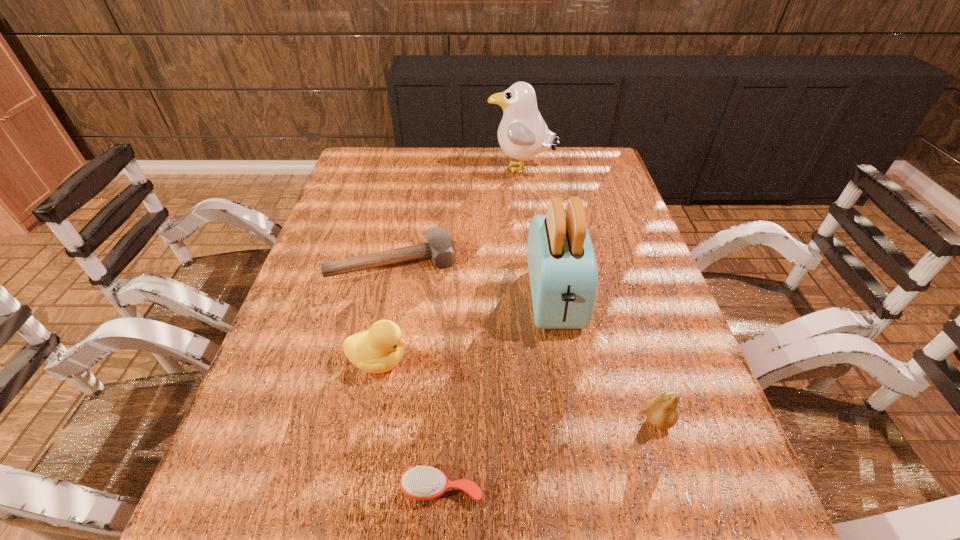
You are a GUI agent. You are given a task and a screenshot of the screen. Output one action in this format:
    pyautogui.click(x=<x>, y=<y>)
    Task: Click on the free space between the farthest object and the nearest object
    The height and width of the screenshot is (540, 960).
    Given the screenshot: What is the action you would take?
    pyautogui.click(x=481, y=329)

Locate an element on the screen. free spot between the toaster and the shortest object is located at coordinates (498, 393).

Choose which object is the fourth nearest neighbor to the second shortest object. Please provide its 2D coordinates. Your answer should be formatted as a tuple, i.e. [(x, y)], where the tuple contains the x and y coordinates of a point satisfying the conditions above.

[(419, 482)]

Where is `object that is the third closest to the shortest object`? object that is the third closest to the shortest object is located at coordinates (662, 411).

Find the location of a particular element. vacant space that satisfies the following two spatial constraints: 1. on the side of the toaster with the lever; 2. on the front-facing side of the duck is located at coordinates (565, 361).

Image resolution: width=960 pixels, height=540 pixels. I want to click on free region that satisfies the following two spatial constraints: 1. on the back side of the second nearest object; 2. on the front-facing side of the fourth farthest object, so click(x=640, y=361).

This screenshot has height=540, width=960. I want to click on free point that satisfies the following two spatial constraints: 1. on the back side of the pear; 2. on the beak of the gull, so click(x=580, y=170).

Locate an element on the screen. vacant space that satisfies the following two spatial constraints: 1. on the beak of the gull; 2. on the front side of the fifth tallest object is located at coordinates (533, 261).

What are the coordinates of `vacant point that satisfies the following two spatial constraints: 1. on the front-facing side of the duck; 2. on the right side of the shortest object` in the screenshot? It's located at (353, 488).

The width and height of the screenshot is (960, 540). Find the location of `free space that satisfies the following two spatial constraints: 1. on the beak of the farthest object; 2. on the front side of the nearest object`. free space that satisfies the following two spatial constraints: 1. on the beak of the farthest object; 2. on the front side of the nearest object is located at coordinates (562, 488).